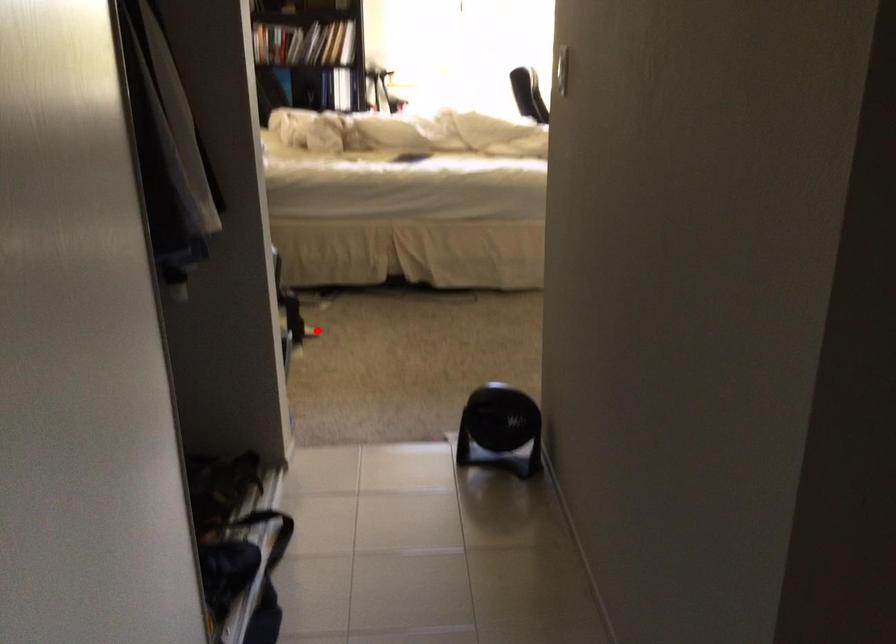
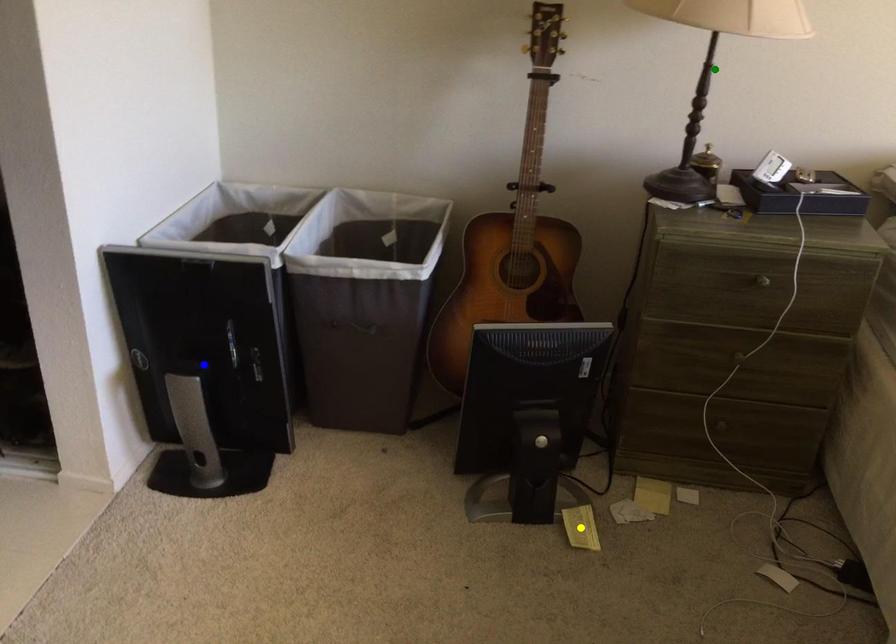
Question: I am providing you with two images of the same scene from different viewpoints. A red point is marked on the first image. You are given multiple points on the second image. Can you choose the point in image 2 that corresponds to the point in image 1?

Choices:
 (A) yellow point
 (B) green point
 (C) blue point

Answer: (A)